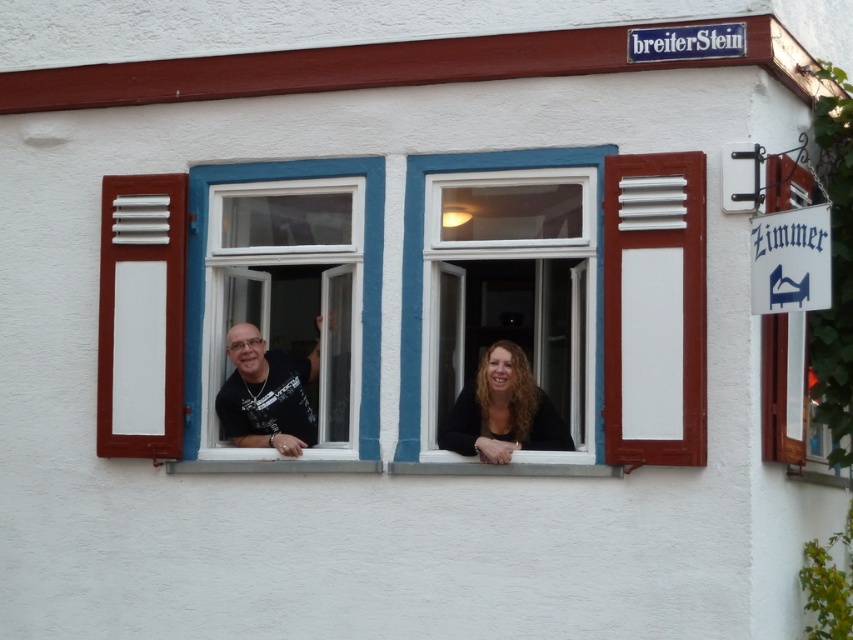
You are standing in front of the building and want to touch both the white plastic window at center and the white wooden signboard at right. Which object can you reach first without moving your position?

The white plastic window at center is closer to you than the white wooden signboard at right, so you can reach the white plastic window at center first without moving your position.

You are standing in front of the building and notice the white painted wood at right and the matte black shirt at center. Which object is positioned higher relative to the other?

The white painted wood at right is located above the matte black shirt at center, so it is positioned higher.

You are standing in front of a building with a white facade and red trim. You notice a point marked at coordinates (654, 308). Based on the scene description, what material does this point correspond to?

The point corresponds to white painted wood at right.